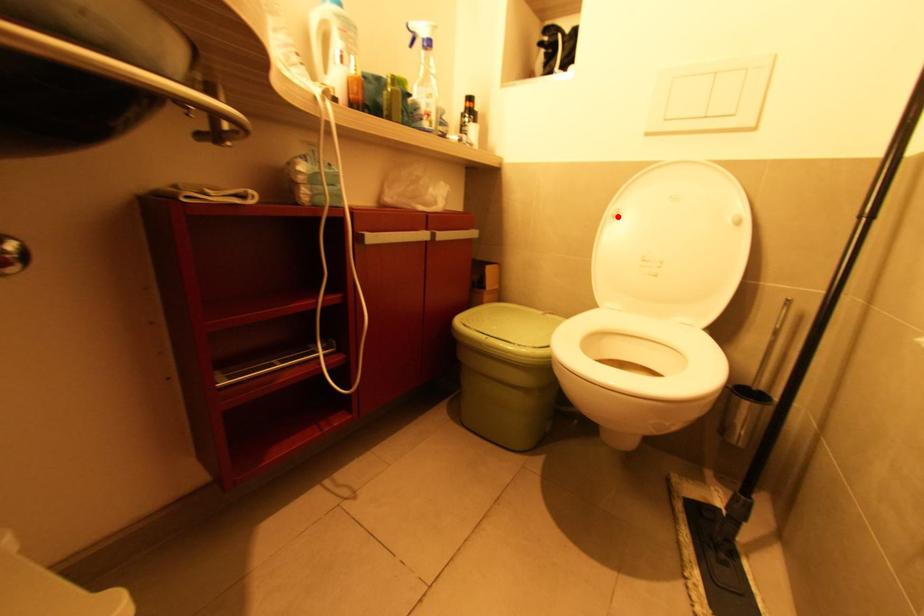
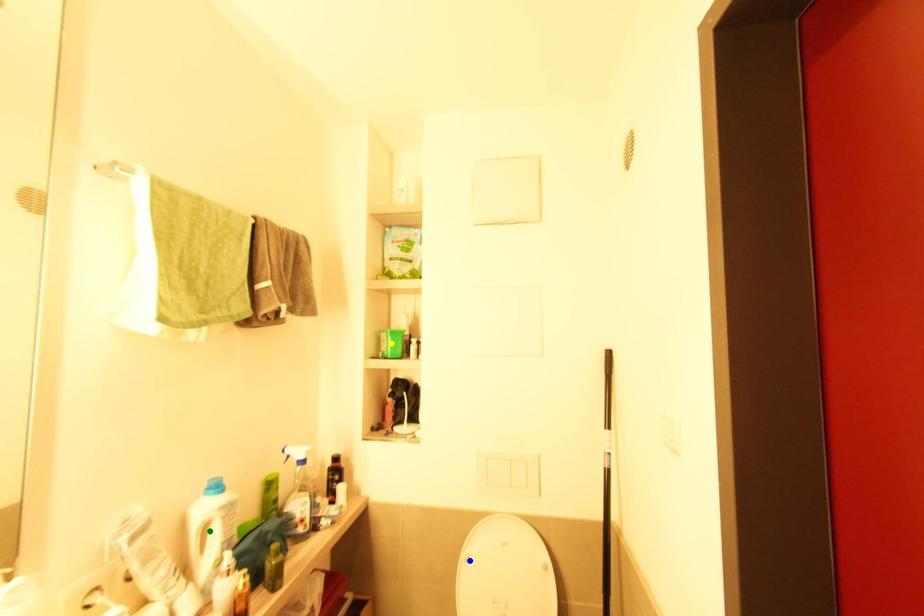
Question: I am providing you with two images of the same scene from different viewpoints. A red point is marked on the first image. You are given multiple points on the second image. In image 2, which mark is for the same physical point as the one in image 1?

Choices:
 (A) green point
 (B) yellow point
 (C) blue point

Answer: (C)